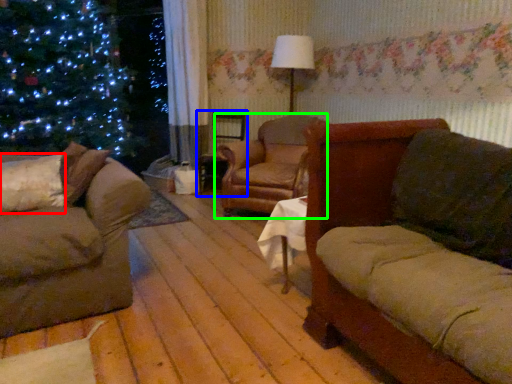
Question: Which object is positioned closest to pillow (highlighted by a red box)? Select from swivel chair (highlighted by a blue box) and chair (highlighted by a green box).

Choices:
 (A) swivel chair
 (B) chair

Answer: (B)